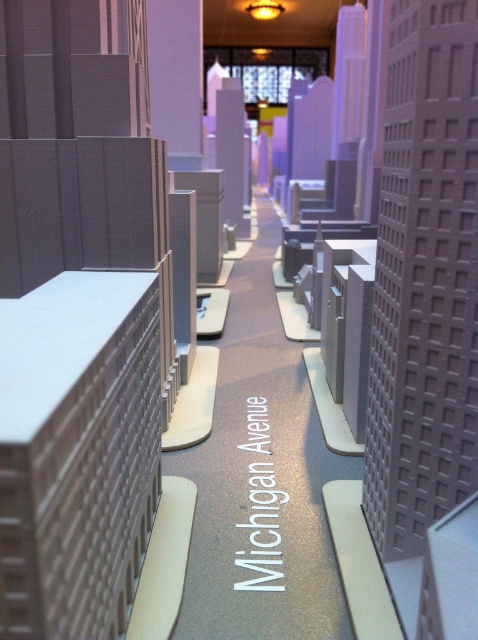
Question: Which object appears farthest from the camera in this image?

Choices:
 (A) purple matte building at center
 (B) matte gray pillar at center

Answer: (A)

Question: Is brown textured building at center-right wider than matte gray pillar at center?

Choices:
 (A) no
 (B) yes

Answer: (B)

Question: Which object appears farthest from the camera in this image?

Choices:
 (A) matte gray pillar at center
 (B) brown textured building at center-right
 (C) purple matte building at center

Answer: (C)

Question: Is brown textured building at center-right smaller than matte gray pillar at center?

Choices:
 (A) no
 (B) yes

Answer: (A)

Question: Which point is farther to the camera?

Choices:
 (A) pyautogui.click(x=229, y=93)
 (B) pyautogui.click(x=432, y=83)

Answer: (A)

Question: Does brown textured building at center-right appear on the right side of purple matte building at center?

Choices:
 (A) no
 (B) yes

Answer: (B)